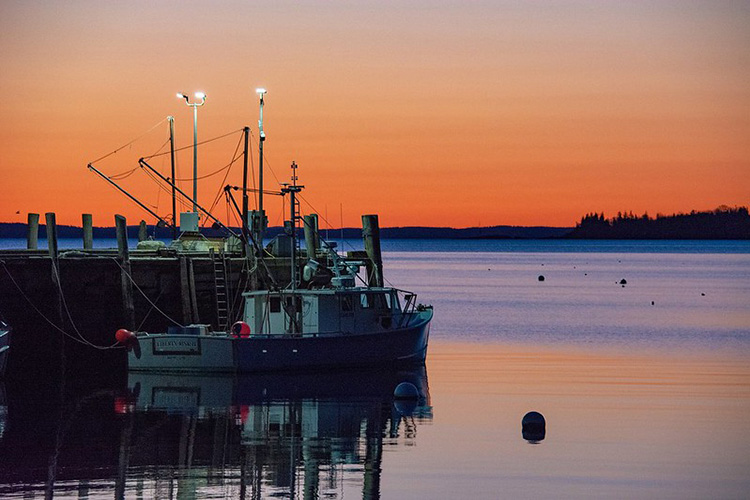
Image resolution: width=750 pixels, height=500 pixels. Find the location of `lights`. lights is located at coordinates point(324,148), point(262,94), point(199,98), point(180,97).